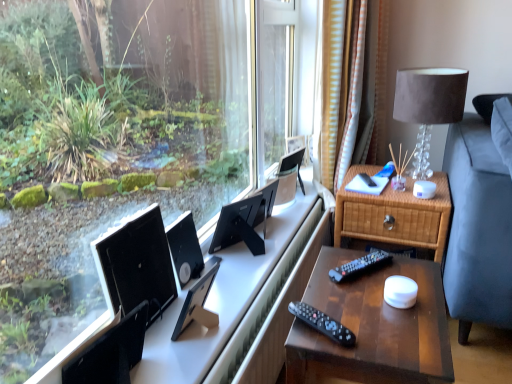
Question: From the image's perspective, is wooden nightstand at right, which is the second nightstand in back-to-front order, located beneath black matte computer monitor at center, arranged as the 2th computer monitor when viewed from the back?

Choices:
 (A) yes
 (B) no

Answer: (A)

Question: From the image's perspective, is wooden nightstand at right, which is the second nightstand in back-to-front order, located above black matte computer monitor at center, arranged as the 2th computer monitor when viewed from the back?

Choices:
 (A) no
 (B) yes

Answer: (A)

Question: Does wooden nightstand at right, which is the second nightstand in back-to-front order, come in front of black matte computer monitor at center, which is counted as the third computer monitor, starting from the front?

Choices:
 (A) yes
 (B) no

Answer: (A)

Question: Is black matte computer monitor at center, which is counted as the third computer monitor, starting from the front, inside wooden nightstand at right, acting as the first nightstand starting from the front?

Choices:
 (A) yes
 (B) no

Answer: (B)

Question: Can you confirm if wooden nightstand at right, which is the second nightstand in back-to-front order, is smaller than black matte computer monitor at center, arranged as the 2th computer monitor when viewed from the back?

Choices:
 (A) yes
 (B) no

Answer: (B)

Question: Is woven wood nightstand at right, marked as the 2th nightstand in a front-to-back arrangement, to the left or to the right of black matte computer monitor at center, which is counted as the third computer monitor, starting from the front, in the image?

Choices:
 (A) right
 (B) left

Answer: (A)

Question: From a real-world perspective, is woven wood nightstand at right, marked as the 2th nightstand in a front-to-back arrangement, above or below black matte computer monitor at center, which is counted as the third computer monitor, starting from the front?

Choices:
 (A) below
 (B) above

Answer: (A)

Question: Considering the positions of point (381, 215) and point (195, 243), is point (381, 215) closer or farther from the camera than point (195, 243)?

Choices:
 (A) farther
 (B) closer

Answer: (A)

Question: Choose the correct answer: Is woven wood nightstand at right, marked as the 2th nightstand in a front-to-back arrangement, inside black matte computer monitor at center, which is counted as the third computer monitor, starting from the front, or outside it?

Choices:
 (A) outside
 (B) inside

Answer: (A)

Question: Is wooden nightstand at right, acting as the first nightstand starting from the front, in front of or behind matte black monitor at center, which appears as the second computer monitor when viewed from the front, in the image?

Choices:
 (A) behind
 (B) front

Answer: (B)

Question: From a real-world perspective, is wooden nightstand at right, which is the second nightstand in back-to-front order, positioned above or below matte black monitor at center, which appears as the second computer monitor when viewed from the front?

Choices:
 (A) above
 (B) below

Answer: (B)

Question: Based on their positions, is wooden nightstand at right, acting as the first nightstand starting from the front, located to the left or right of matte black monitor at center, which appears as the second computer monitor when viewed from the front?

Choices:
 (A) right
 (B) left

Answer: (A)

Question: Does point (442, 337) appear closer or farther from the camera than point (187, 297)?

Choices:
 (A) closer
 (B) farther

Answer: (A)

Question: Is matte black monitor at center, marked as the 3th computer monitor in a back-to-front arrangement, bigger or smaller than black plastic remote control at lower center, which is counted as the 2th remote control, starting from the right?

Choices:
 (A) big
 (B) small

Answer: (A)

Question: Do you think matte black monitor at center, which appears as the second computer monitor when viewed from the front, is within black plastic remote control at lower center, acting as the second remote control starting from the back, or outside of it?

Choices:
 (A) outside
 (B) inside

Answer: (A)